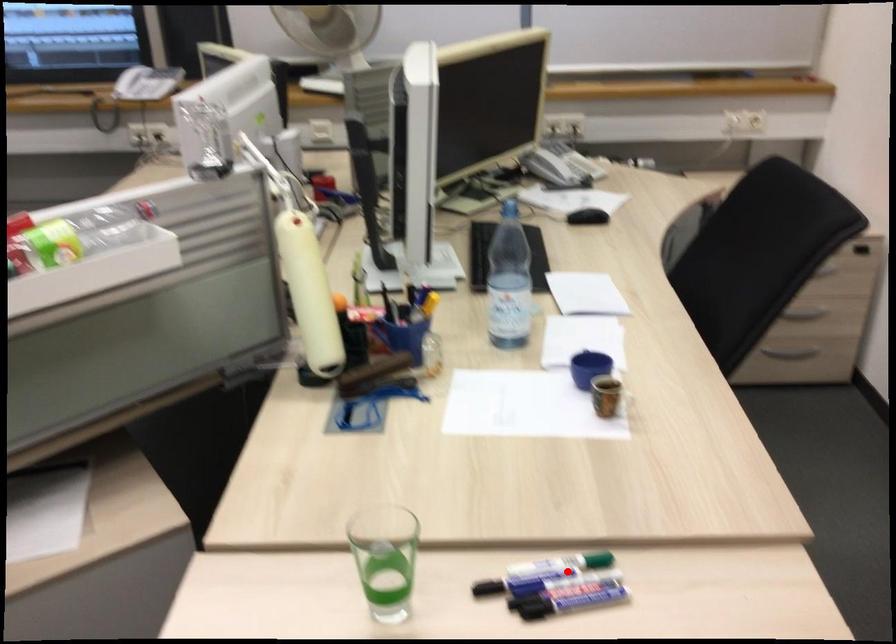
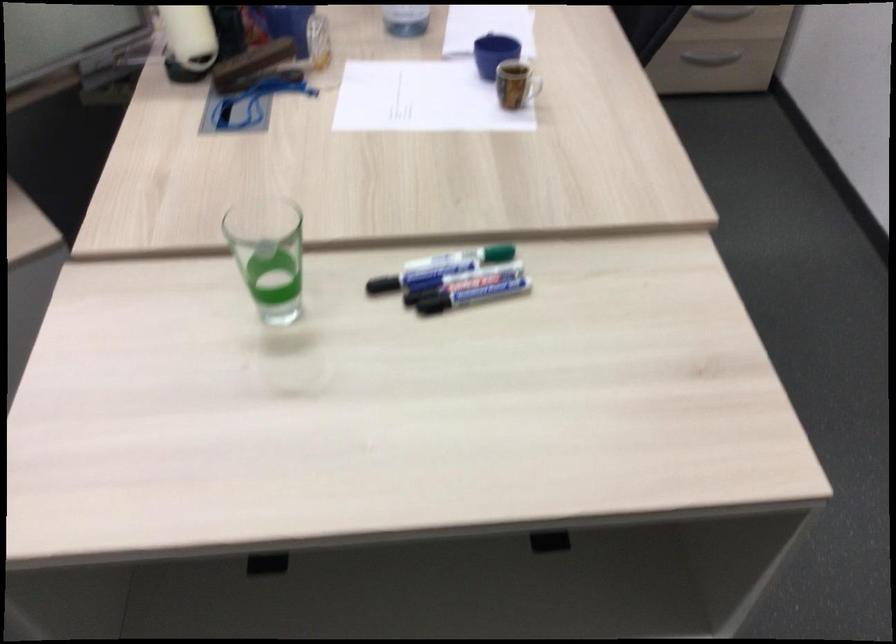
In the second image, find the point that corresponds to the highlighted location in the first image.

(462, 258)